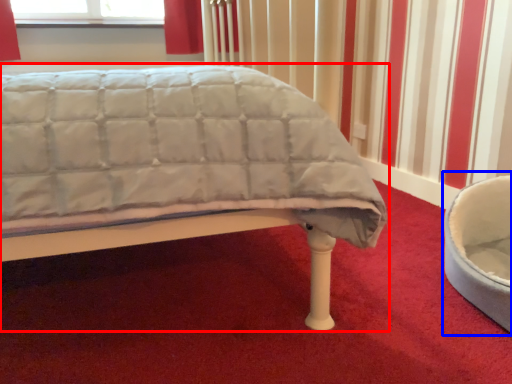
Question: Which object is closer to the camera taking this photo, bed (highlighted by a red box) or bean bag chair (highlighted by a blue box)?

Choices:
 (A) bed
 (B) bean bag chair

Answer: (A)